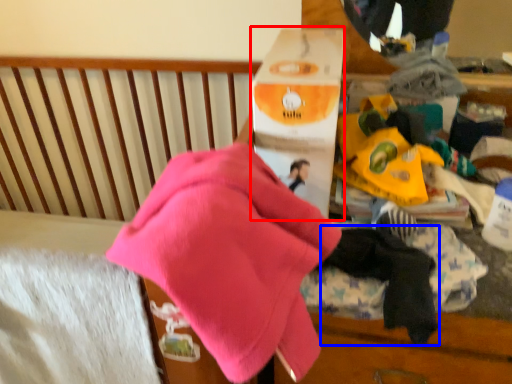
Question: Which object is closer to the camera taking this photo, cardboard box (highlighted by a red box) or baby clothe (highlighted by a blue box)?

Choices:
 (A) cardboard box
 (B) baby clothe

Answer: (B)